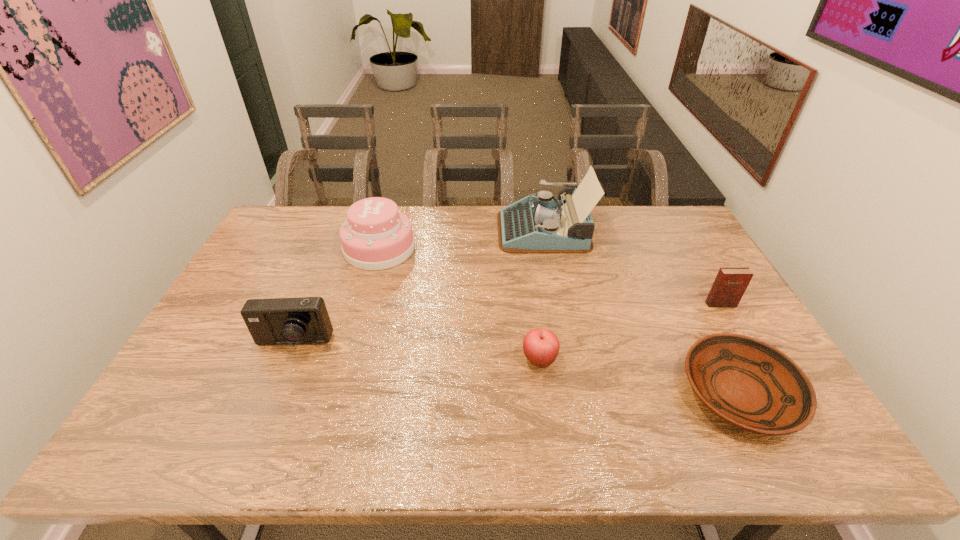
Where is `vacant space located on the front-facing side of the camera`? This screenshot has height=540, width=960. vacant space located on the front-facing side of the camera is located at coordinates (257, 433).

Image resolution: width=960 pixels, height=540 pixels. In order to click on free space located on the front cover of the diary in this screenshot , I will do `click(735, 330)`.

Locate an element on the screen. The height and width of the screenshot is (540, 960). free space located 0.240m on the right of the fifth tallest object is located at coordinates (648, 359).

Locate an element on the screen. The width and height of the screenshot is (960, 540). vacant region located 0.050m on the back of the shortest object is located at coordinates (709, 335).

This screenshot has height=540, width=960. Find the location of `typewriter located in the far edge section of the desktop`. typewriter located in the far edge section of the desktop is located at coordinates (540, 224).

At what (x,y) coordinates should I click in order to perform the action: click on birthday cake positioned at the far edge. Please return your answer as a coordinate pair (x, y). This screenshot has width=960, height=540. Looking at the image, I should click on (376, 236).

Locate an element on the screen. This screenshot has width=960, height=540. object at the near edge is located at coordinates coord(748,383).

Where is `object at the left edge`? object at the left edge is located at coordinates (304, 320).

Locate an element on the screen. diary located in the right edge section of the desktop is located at coordinates (730, 284).

This screenshot has width=960, height=540. What are the coordinates of `plate located in the right edge section of the desktop` in the screenshot? It's located at (748, 383).